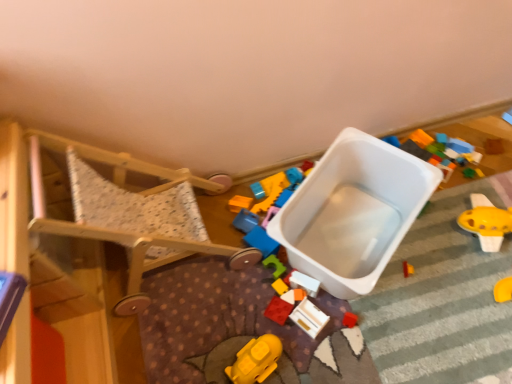
Find the location of a particular element. Image resolution: width=512 pixels, height=384 pixels. free space between white plastic toy at center, which ranks as the fourth toy in left-to-right order, and yellow matte toy at lower center, placed as the 6th toy when sorted from right to left is located at coordinates (281, 317).